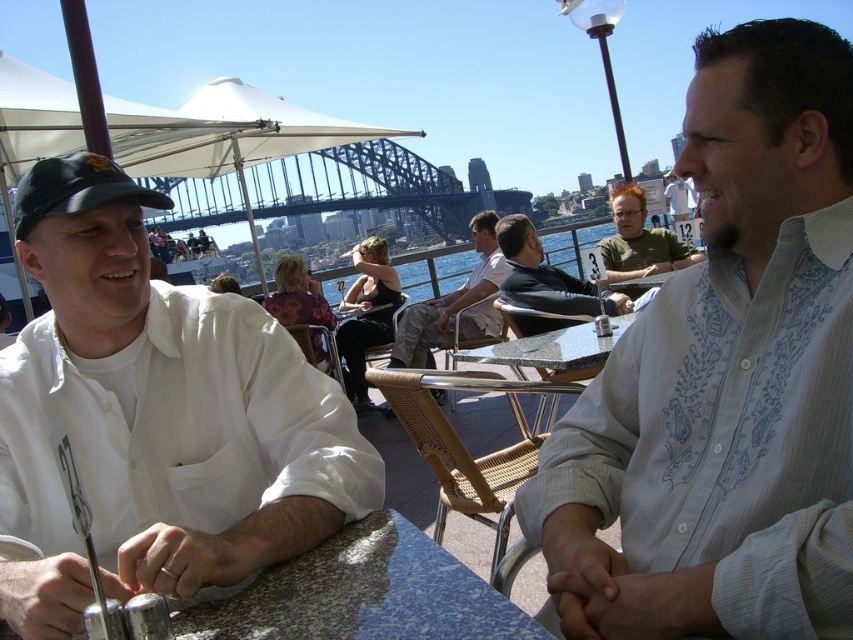
You are a photographer trying to capture a candid shot of the camouflage pants at center and the light blue shirt at center from your position behind the Sydney Harbour Bridge. Considering the distance between them, would you need a telephoto lens to ensure both subjects are in focus and clearly visible?

The distance between the camouflage pants at center and the light blue shirt at center is 50.54 meters. Since they are far apart, a telephoto lens would help to compress the distance and keep both subjects in focus and clearly visible from your position behind the Sydney Harbour Bridge.